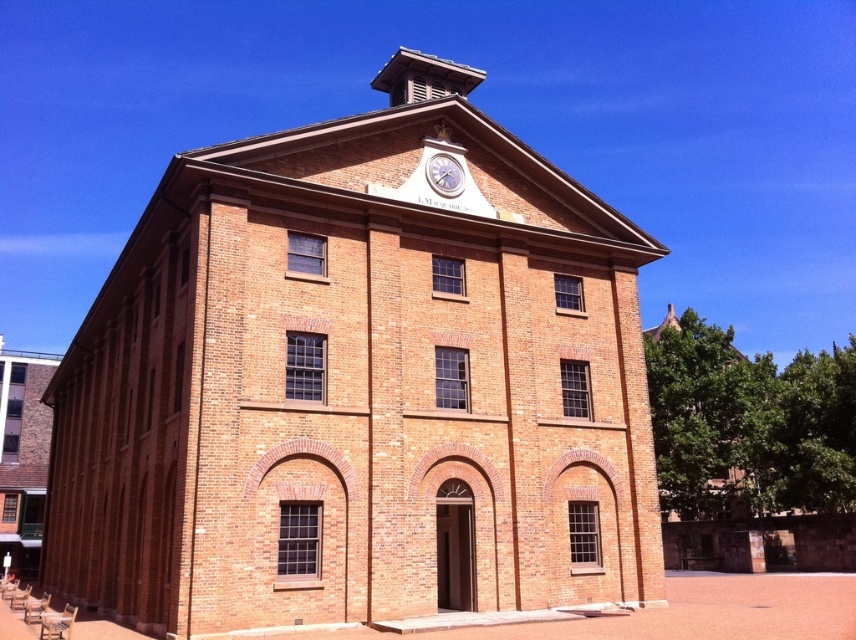
Question: Can you confirm if brown brick building at center is positioned to the left of metallic silver clock at center?

Choices:
 (A) yes
 (B) no

Answer: (A)

Question: Is brown brick building at center positioned in front of metallic silver clock at center?

Choices:
 (A) yes
 (B) no

Answer: (A)

Question: In this image, where is brown brick building at center located relative to metallic silver clock at center?

Choices:
 (A) right
 (B) left

Answer: (B)

Question: Which object appears closest to the camera in this image?

Choices:
 (A) metallic silver clock at center
 (B) brown brick building at center

Answer: (B)